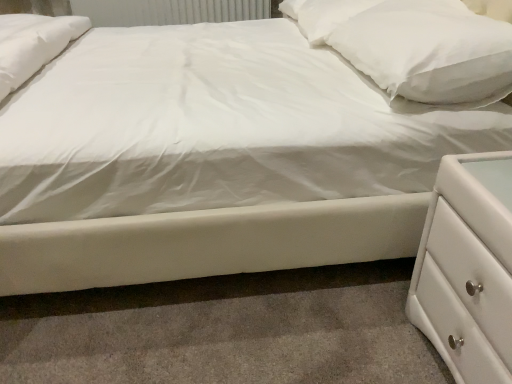
Question: In terms of width, does white soft pillow at upper right, which ranks as the 2th pillow in front-to-back order, look wider or thinner when compared to white textured radiator at upper center?

Choices:
 (A) wide
 (B) thin

Answer: (A)

Question: Which is correct: white soft pillow at upper right, the 1th pillow in the back-to-front sequence, is inside white textured radiator at upper center, or outside of it?

Choices:
 (A) outside
 (B) inside

Answer: (A)

Question: Which of these objects is positioned closest to the white soft pillow at upper right, the 2th pillow when ordered from back to front?

Choices:
 (A) white soft pillow at upper right, which ranks as the 2th pillow in front-to-back order
 (B) white textured radiator at upper center
 (C) white glossy chest of drawers at lower right

Answer: (A)

Question: Estimate the real-world distances between objects in this image. Which object is closer to the white glossy chest of drawers at lower right?

Choices:
 (A) white soft pillow at upper right, which ranks as the 2th pillow in front-to-back order
 (B) white textured radiator at upper center
 (C) white soft pillow at upper right, the 1th pillow when ordered from front to back

Answer: (C)